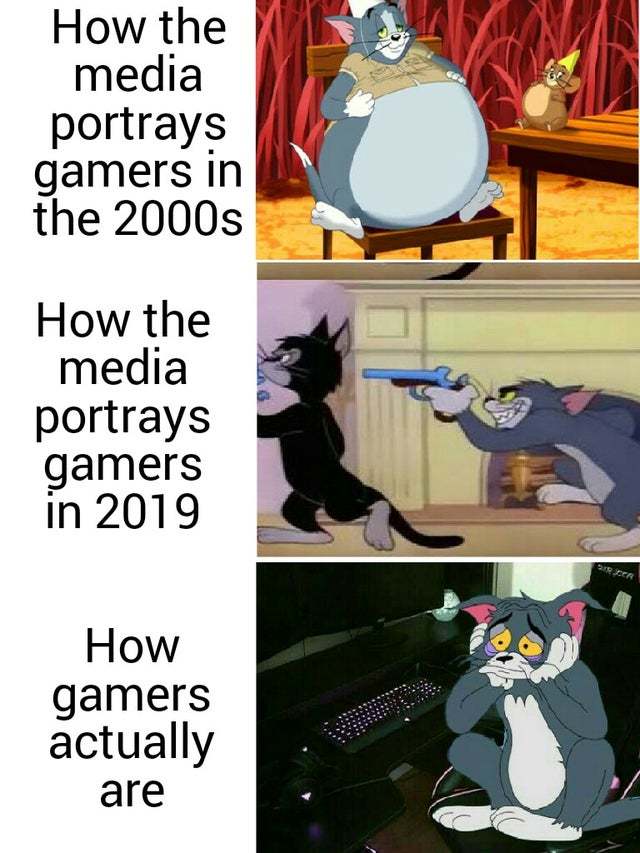
Image resolution: width=640 pixels, height=853 pixels. In order to click on table in this screenshot , I will do `click(608, 143)`.